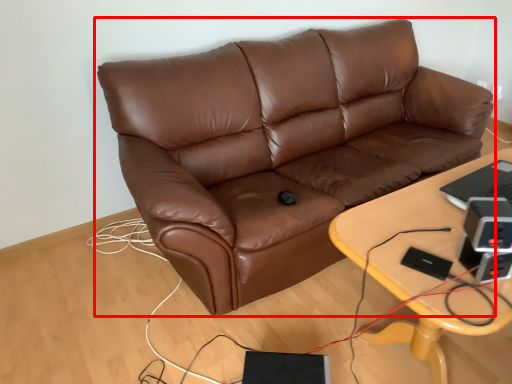
Question: From the image's perspective, considering the relative positions of studio couch (annotated by the red box) and table in the image provided, where is studio couch (annotated by the red box) located with respect to the staircase?

Choices:
 (A) below
 (B) above

Answer: (B)